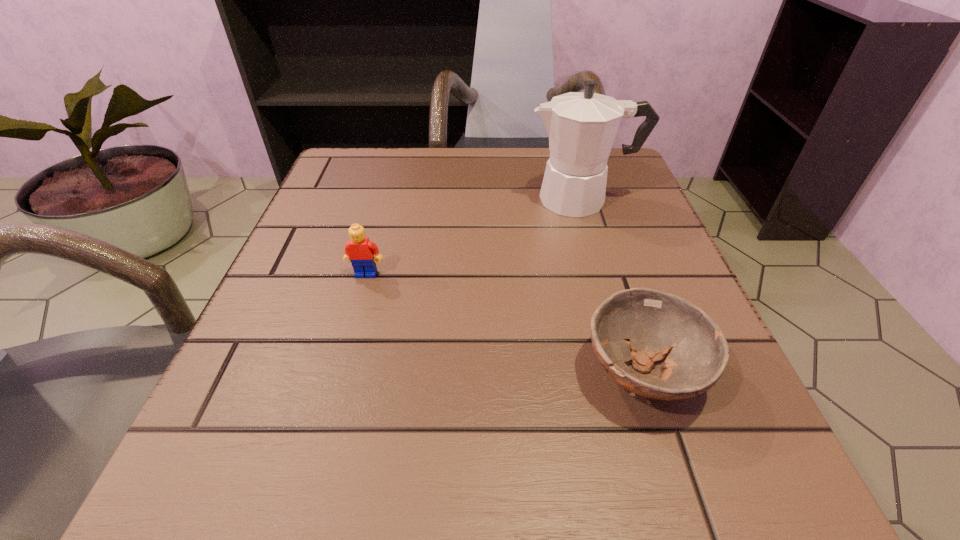
You are a GUI agent. You are given a task and a screenshot of the screen. Output one action in this format:
    pyautogui.click(x=<x>, y=<y>)
    Task: Click on the vacant space that satisfies the following two spatial constraints: 1. at the spout of the nearest object; 2. on the left side of the coffeepot
    The width and height of the screenshot is (960, 540).
    Given the screenshot: What is the action you would take?
    pyautogui.click(x=635, y=372)

I want to click on vacant space that satisfies the following two spatial constraints: 1. at the spout of the nearest object; 2. on the right side of the coffeepot, so click(x=635, y=372).

Locate an element on the screen. This screenshot has width=960, height=540. free space that satisfies the following two spatial constraints: 1. at the spout of the tallest object; 2. on the face of the second shortest object is located at coordinates (605, 274).

The image size is (960, 540). I want to click on vacant area in the image that satisfies the following two spatial constraints: 1. on the face of the shortest object; 2. on the right side of the leftmost object, so click(x=339, y=372).

The width and height of the screenshot is (960, 540). What are the coordinates of `blank area in the image that satisfies the following two spatial constraints: 1. at the spout of the farthest object; 2. on the face of the Lego` in the screenshot? It's located at (605, 274).